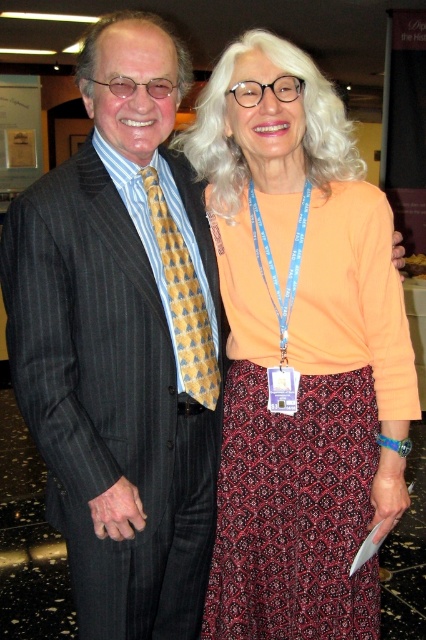
Question: Which object appears farthest from the camera in this image?

Choices:
 (A) yellowpatterned fabrictie at center
 (B) matte orange blouse at center
 (C) dark red patterned skirt at center

Answer: (C)

Question: Does matte orange blouse at center have a lesser width compared to dark red patterned skirt at center?

Choices:
 (A) no
 (B) yes

Answer: (A)

Question: Which of the following is the closest to the observer?

Choices:
 (A) matte black suit at center
 (B) dark red patterned skirt at center
 (C) yellowpatterned fabrictie at center

Answer: (A)

Question: Considering the relative positions of matte orange blouse at center and dark red patterned skirt at center in the image provided, where is matte orange blouse at center located with respect to dark red patterned skirt at center?

Choices:
 (A) above
 (B) below

Answer: (A)

Question: Is dark red patterned skirt at center positioned behind yellowpatterned fabrictie at center?

Choices:
 (A) no
 (B) yes

Answer: (B)

Question: Which object appears farthest from the camera in this image?

Choices:
 (A) matte black suit at center
 (B) yellowpatterned fabrictie at center

Answer: (B)